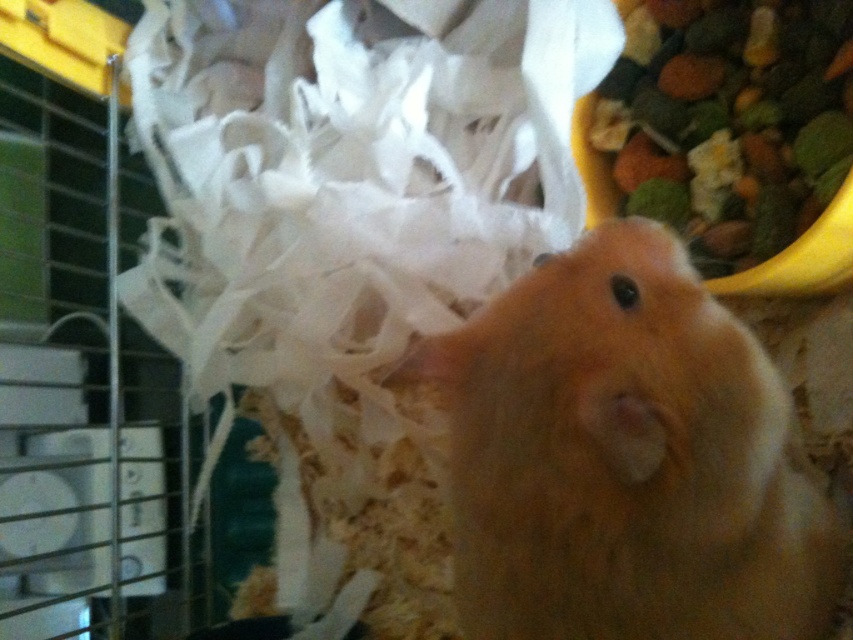
You are a pet owner who wants to ensure your fluffy orange hamster at center has enough space to move around in its cage. Considering the multicolored grain mix at upper right is nearby, can you determine if the hamster is wider than the food dish?

The fluffy orange hamster at center is wider than the multicolored grain mix at upper right, so the hamster has sufficient space to move around without the food dish being an obstruction.

Looking at this image, you are a pet owner who wants to give your fluffy orange hamster at center some food from the multicolored grain mix at upper right. Based on the image, which direction should you move the dish to place it closer to the hamster?

The fluffy orange hamster at center is positioned on the left side of the multicolored grain mix at upper right, so to place the dish closer to the hamster, you should move the multicolored grain mix at upper right to the left.

You are a veterinarian examining an image of a hamster in a cage. The coordinates point to a specific location. Based on the scene description, what animal is located at the coordinates point (625, 458)?

The point (625, 458) indicates the fluffy orange hamster at center.